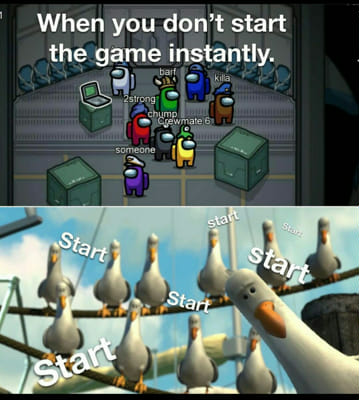
At what (x,y) coordinates should I click in order to perform the action: click on chair. Please return your answer as a coordinate pair (x, y). The height and width of the screenshot is (400, 359). Looking at the image, I should click on tap(26, 79), tap(48, 74), tap(58, 68), tap(75, 68), tap(94, 49), tap(218, 62), tap(227, 68), tap(249, 72), tap(262, 80), tap(279, 81).